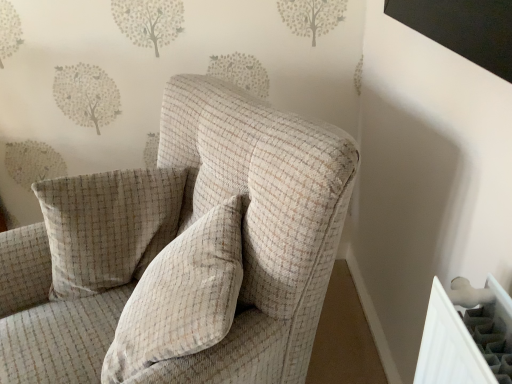
Question: From a real-world perspective, is beige checkered armchair at center located higher than beige checkered pillow at center, the 1th pillow positioned from the front?

Choices:
 (A) no
 (B) yes

Answer: (A)

Question: Can beige checkered pillow at center, the second pillow when ordered from back to front, be found inside beige checkered armchair at center?

Choices:
 (A) yes
 (B) no

Answer: (A)

Question: Does beige checkered armchair at center come behind beige checkered pillow at center, the second pillow when ordered from back to front?

Choices:
 (A) no
 (B) yes

Answer: (A)

Question: Is beige checkered armchair at center with beige checkered pillow at center, the second pillow when ordered from back to front?

Choices:
 (A) yes
 (B) no

Answer: (A)

Question: From the image's perspective, is beige checkered armchair at center located beneath beige checkered pillow at center, the second pillow when ordered from back to front?

Choices:
 (A) yes
 (B) no

Answer: (A)

Question: Considering the relative sizes of beige checkered armchair at center and beige checkered pillow at center, the 1th pillow positioned from the front, in the image provided, is beige checkered armchair at center taller than beige checkered pillow at center, the 1th pillow positioned from the front,?

Choices:
 (A) yes
 (B) no

Answer: (A)

Question: From a real-world perspective, is beige checkered pillow at center, the second pillow when ordered from back to front, beneath beige checkered pillow at center, the second pillow from the front?

Choices:
 (A) no
 (B) yes

Answer: (A)

Question: Is beige checkered pillow at center, the second pillow when ordered from back to front, shorter than beige checkered pillow at center, the second pillow from the front?

Choices:
 (A) yes
 (B) no

Answer: (A)

Question: Considering the relative sizes of beige checkered pillow at center, the second pillow when ordered from back to front, and beige checkered pillow at center, the second pillow from the front, in the image provided, is beige checkered pillow at center, the second pillow when ordered from back to front, bigger than beige checkered pillow at center, the second pillow from the front,?

Choices:
 (A) no
 (B) yes

Answer: (B)

Question: Is beige checkered pillow at center, the second pillow from the front, located within beige checkered pillow at center, the 1th pillow positioned from the front?

Choices:
 (A) yes
 (B) no

Answer: (B)

Question: Does beige checkered pillow at center, the 1th pillow positioned from the front, come in front of beige checkered pillow at center, which ranks as the 1th pillow in back-to-front order?

Choices:
 (A) yes
 (B) no

Answer: (A)

Question: Is there a large distance between beige checkered pillow at center, the 1th pillow positioned from the front, and beige checkered pillow at center, the second pillow from the front?

Choices:
 (A) yes
 (B) no

Answer: (B)

Question: From a real-world perspective, is beige checkered pillow at center, the second pillow from the front, over beige checkered pillow at center, the 1th pillow positioned from the front?

Choices:
 (A) yes
 (B) no

Answer: (B)